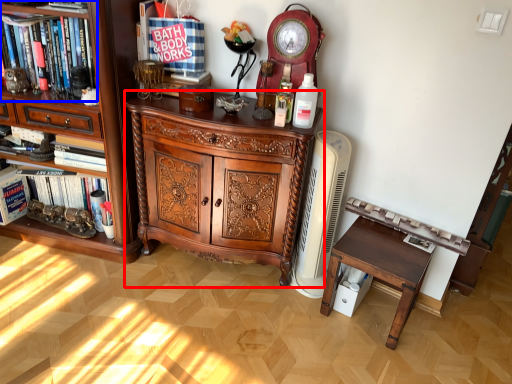
Question: Which object appears closest to the camera in this image, chest of drawers (highlighted by a red box) or shelf (highlighted by a blue box)?

Choices:
 (A) chest of drawers
 (B) shelf

Answer: (A)